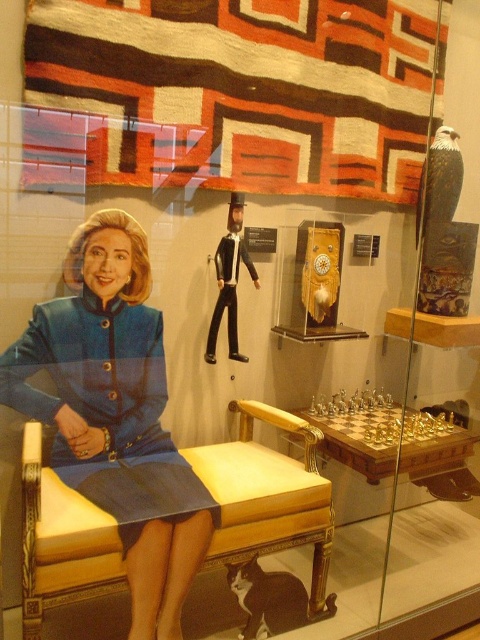
You are standing in front of the display case and want to touch the point at coordinates (93, 326). If your hand can reach up to 1.5 meters, will you be able to reach it?

The point at coordinates (93, 326) is 1.88 meters away from the viewer. Since your hand can only reach up to 1.5 meters, you will not be able to reach it.

You are a museum visitor trying to take a photo of the blue fabric dress at center and the yellow upholstered chair at center. The camera you have can only focus on objects wider than 1 meter. Can both items be captured clearly in the photo?

The blue fabric dress at center has a larger width than the yellow upholstered chair at center. Since the blue fabric dress at center is wider than 1 meter, the yellow upholstered chair at center might also be over 1 meter. However, without exact measurements, it is uncertain if both are wider than 1 meter. The camera might not focus properly on the narrower one.

You are a visitor at the museum and want to take a photo of the blue fabric dress at center. The museum allows photos only if the object is placed exactly at the coordinate point specified. Is the blue fabric dress at center positioned correctly at point [113,410]?

Yes, the blue fabric dress at center is located at point [113,410], so it is positioned correctly for the photo.